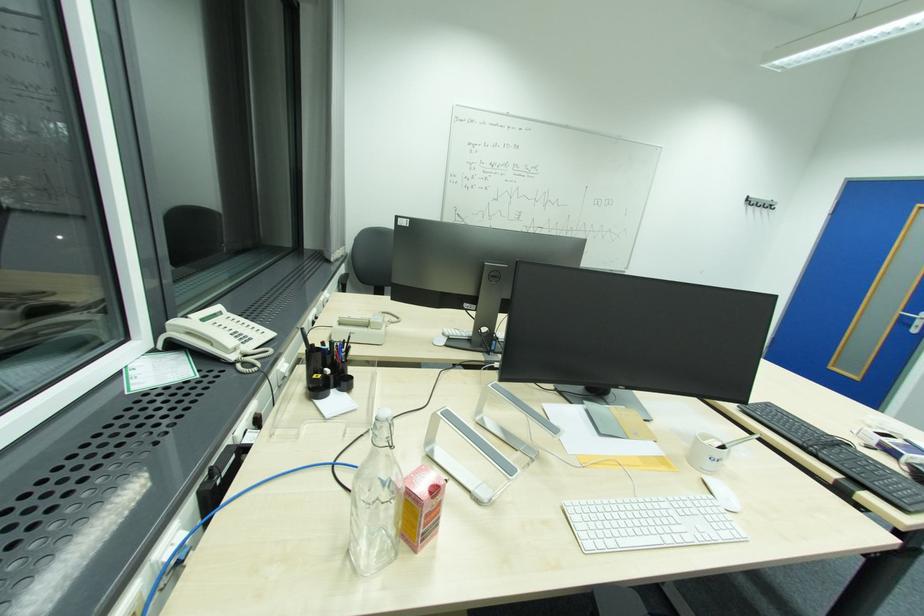
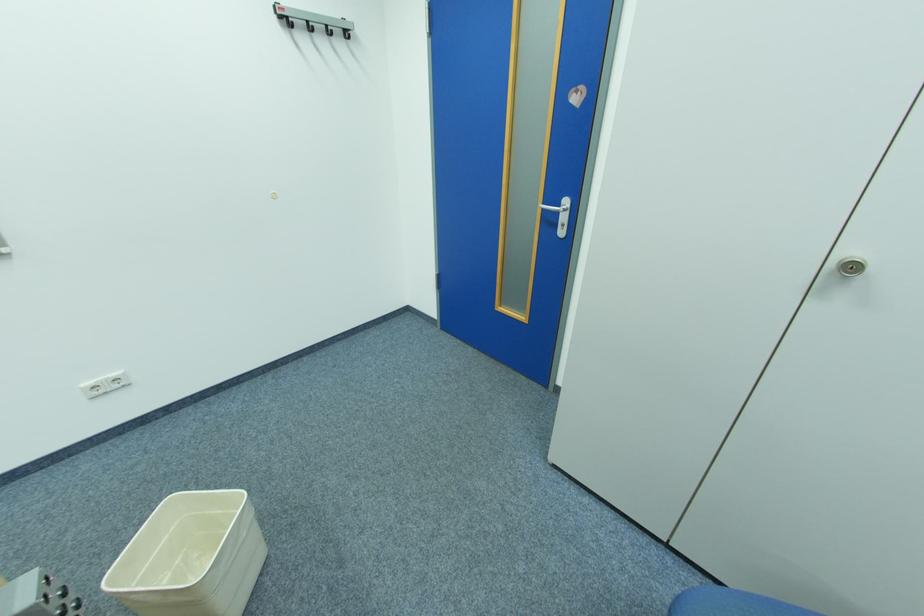
In the second image, find the point that corresponds to (755,204) in the first image.

(290, 25)